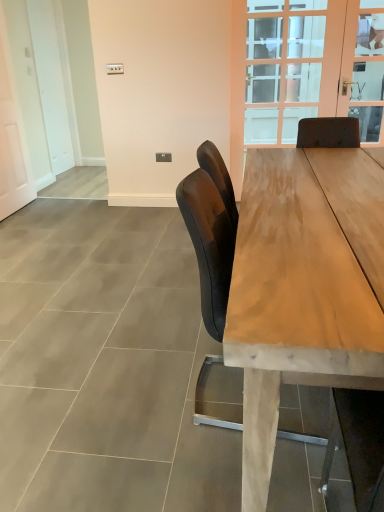
Question: From a real-world perspective, is matte black chair at center beneath wooden table at center?

Choices:
 (A) yes
 (B) no

Answer: (B)

Question: Can you confirm if matte black chair at center is positioned to the right of wooden table at center?

Choices:
 (A) yes
 (B) no

Answer: (B)

Question: Does matte black chair at center contain wooden table at center?

Choices:
 (A) no
 (B) yes

Answer: (A)

Question: Considering the relative sizes of matte black chair at center and wooden table at center in the image provided, is matte black chair at center bigger than wooden table at center?

Choices:
 (A) yes
 (B) no

Answer: (B)

Question: From the image's perspective, is matte black chair at center located beneath wooden table at center?

Choices:
 (A) yes
 (B) no

Answer: (A)

Question: Considering the positions of clear glass door at upper center and wooden table at center in the image, is clear glass door at upper center wider or thinner than wooden table at center?

Choices:
 (A) wide
 (B) thin

Answer: (B)

Question: Is clear glass door at upper center to the left or to the right of wooden table at center in the image?

Choices:
 (A) left
 (B) right

Answer: (B)

Question: Does point (254, 57) appear closer or farther from the camera than point (241, 340)?

Choices:
 (A) farther
 (B) closer

Answer: (A)

Question: Is clear glass door at upper center bigger or smaller than wooden table at center?

Choices:
 (A) big
 (B) small

Answer: (B)

Question: Visually, is matte black chair at center positioned to the left or to the right of clear glass door at upper center?

Choices:
 (A) right
 (B) left

Answer: (B)

Question: Considering the positions of matte black chair at center and clear glass door at upper center in the image, is matte black chair at center taller or shorter than clear glass door at upper center?

Choices:
 (A) short
 (B) tall

Answer: (A)

Question: From the image's perspective, is matte black chair at center located above or below clear glass door at upper center?

Choices:
 (A) above
 (B) below

Answer: (B)

Question: Is matte black chair at center inside the boundaries of clear glass door at upper center, or outside?

Choices:
 (A) outside
 (B) inside

Answer: (A)

Question: Visually, is clear glass door at upper center positioned to the left or to the right of clear glass door at upper right?

Choices:
 (A) left
 (B) right

Answer: (A)

Question: Is clear glass door at upper center bigger or smaller than clear glass door at upper right?

Choices:
 (A) big
 (B) small

Answer: (A)